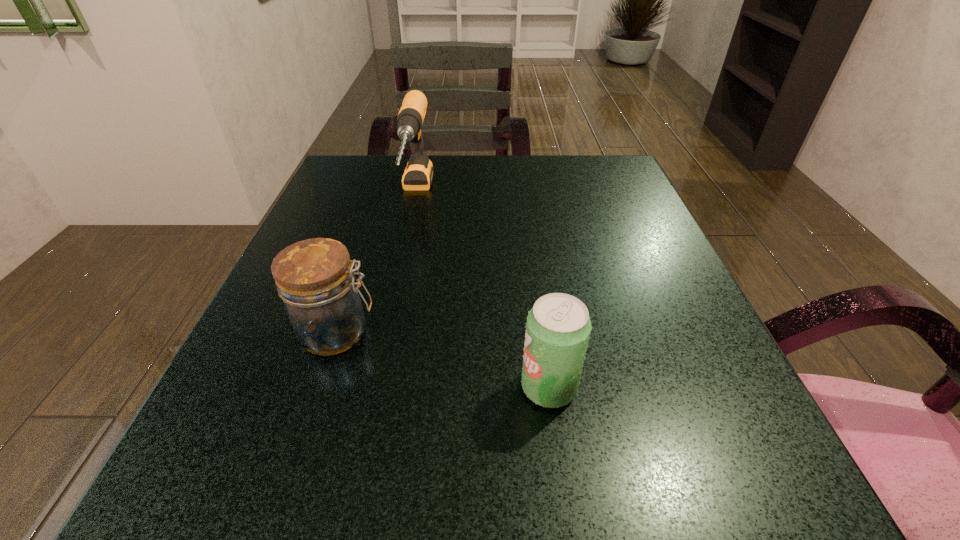
The width and height of the screenshot is (960, 540). What are the coordinates of `the tallest object` in the screenshot? It's located at (418, 174).

Identify the location of drill. (418, 174).

Identify the location of jar. Image resolution: width=960 pixels, height=540 pixels. (315, 278).

This screenshot has height=540, width=960. What are the coordinates of `the rightmost object` in the screenshot? It's located at (558, 327).

At what (x,y) coordinates should I click in order to perform the action: click on the nearest object. Please return your answer as a coordinate pair (x, y). Image resolution: width=960 pixels, height=540 pixels. Looking at the image, I should click on click(558, 327).

Find the location of a particular element. This screenshot has height=540, width=960. free space located on the handle side of the tallest object is located at coordinates (396, 288).

At what (x,y) coordinates should I click in order to perform the action: click on free point located 0.120m on the lid of the jar. Please return your answer as a coordinate pair (x, y). This screenshot has width=960, height=540. Looking at the image, I should click on (453, 333).

Identify the location of vacant space located 0.090m on the back of the nearest object. (540, 319).

In order to click on object present at the far edge in this screenshot , I will do `click(418, 174)`.

Locate an element on the screen. object positioned at the left edge is located at coordinates (315, 278).